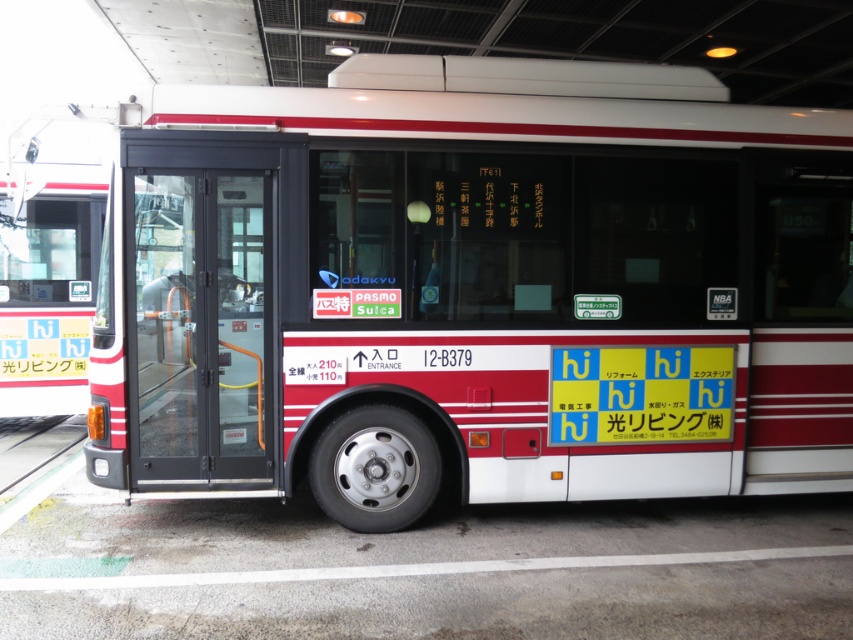
Question: Which object is farther from the camera taking this photo?

Choices:
 (A) white plastic license plate at center
 (B) black glass door at center

Answer: (A)

Question: Can you confirm if black glass door at center is wider than white plastic license plate at center?

Choices:
 (A) yes
 (B) no

Answer: (B)

Question: Which of the following is the closest to the observer?

Choices:
 (A) (579, 413)
 (B) (231, 241)

Answer: (B)

Question: Does black glass door at center have a larger size compared to white plastic license plate at center?

Choices:
 (A) no
 (B) yes

Answer: (B)

Question: Can you confirm if black glass door at center is positioned below white plastic license plate at center?

Choices:
 (A) no
 (B) yes

Answer: (A)